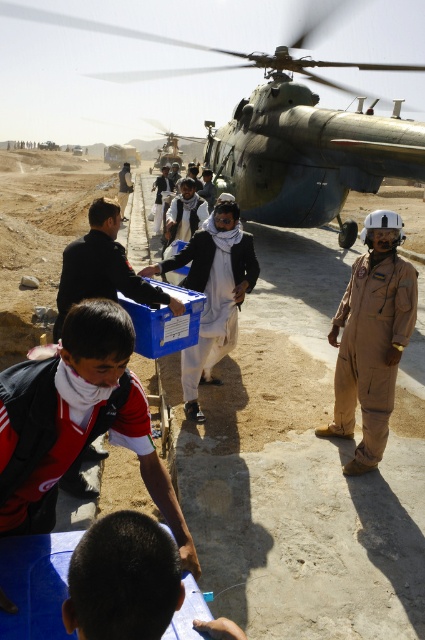
In the scene shown: Who is positioned more to the left, red shirt at center or light brown fabric jacket at center?

light brown fabric jacket at center

Is point (44, 384) less distant than point (124, 172)?

Yes.

Is point (158, 468) farther from camera compared to point (121, 192)?

No.

Identify the location of red shirt at center. (78, 420).

From the picture: Does brown hair at lower center lie behind metallic gray helicopter at upper center?

No, brown hair at lower center is closer to the viewer.

Can you confirm if brown hair at lower center is bigger than metallic gray helicopter at upper center?

No.

Is point (90, 627) in front of point (158, 163)?

Yes, it is.

Where is `brown hair at lower center`? This screenshot has width=425, height=640. brown hair at lower center is located at coordinates (122, 579).

Consider the image. Does green matte helicopter at center appear over matte black shirt at center?

Yes.

Based on the photo, does green matte helicopter at center appear under matte black shirt at center?

No.

Find the location of a particular element. green matte helicopter at center is located at coordinates (172, 56).